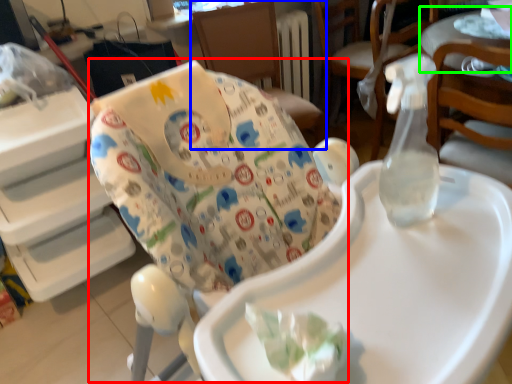
Question: Estimate the real-world distances between objects in this image. Which object is farther from rocking chair (highlighted by a red box), chair (highlighted by a blue box) or table (highlighted by a green box)?

Choices:
 (A) chair
 (B) table

Answer: (A)